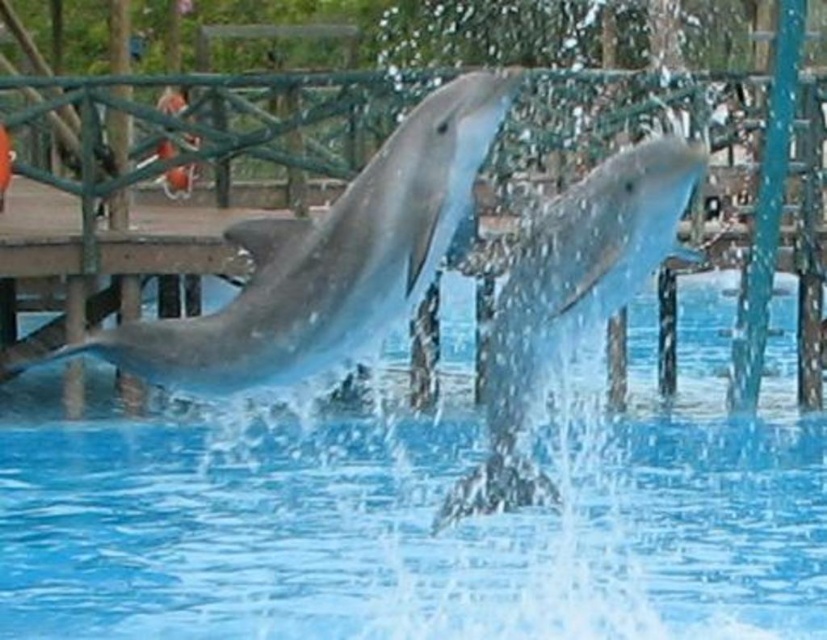
Question: Which of the following is the closest to the observer?

Choices:
 (A) smooth gray dolphin at center
 (B) clear blue water at center
 (C) slick gray dolphin at center

Answer: (A)

Question: Which point is farther from the camera taking this photo?

Choices:
 (A) (615, 195)
 (B) (180, 593)
 (C) (366, 336)

Answer: (B)

Question: Is clear blue water at center bigger than smooth gray dolphin at center?

Choices:
 (A) yes
 (B) no

Answer: (A)

Question: Which object appears closest to the camera in this image?

Choices:
 (A) smooth gray dolphin at center
 (B) slick gray dolphin at center

Answer: (A)

Question: Observing the image, what is the correct spatial positioning of clear blue water at center in reference to smooth gray dolphin at center?

Choices:
 (A) above
 (B) below

Answer: (B)

Question: Is the position of smooth gray dolphin at center more distant than that of slick gray dolphin at center?

Choices:
 (A) no
 (B) yes

Answer: (A)